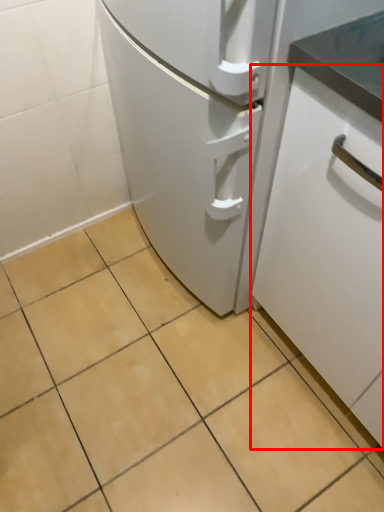
Question: From the image's perspective, where is cabinetry (annotated by the red box) located in relation to ceramic tile in the image?

Choices:
 (A) below
 (B) above

Answer: (B)